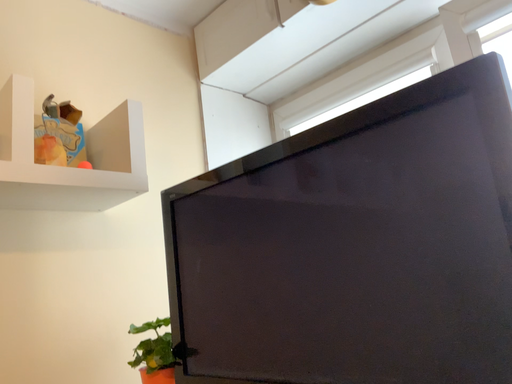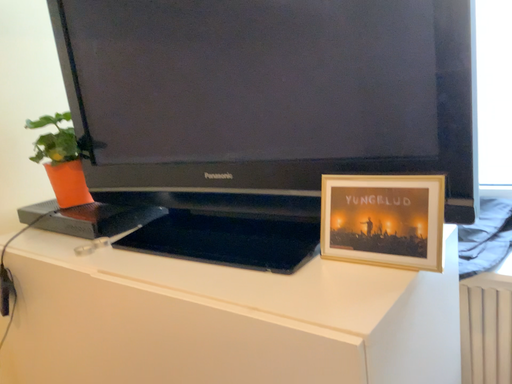
Question: Which way did the camera rotate in the video?

Choices:
 (A) rotated downward
 (B) rotated upward

Answer: (A)